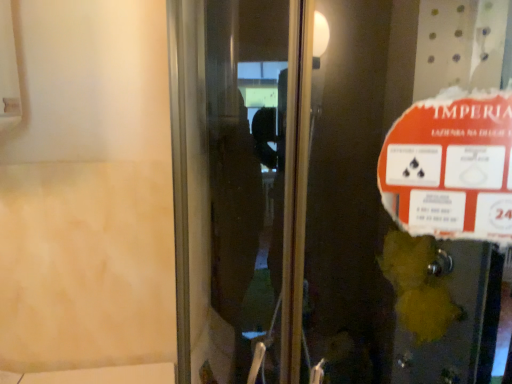
The image size is (512, 384). Describe the element at coordinates (326, 190) in the screenshot. I see `transparent glass elevator door at center` at that location.

Where is `transparent glass elevator door at center`? The width and height of the screenshot is (512, 384). transparent glass elevator door at center is located at coordinates (326, 190).

Image resolution: width=512 pixels, height=384 pixels. Describe the element at coordinates (451, 167) in the screenshot. I see `orange paper sign at upper right` at that location.

Where is `orange paper sign at upper right`? This screenshot has width=512, height=384. orange paper sign at upper right is located at coordinates (451, 167).

The image size is (512, 384). Find the location of `transparent glass elevator door at center`. transparent glass elevator door at center is located at coordinates (326, 190).

Is transparent glass elevator door at center at the left side of orange paper sign at upper right?

Indeed, transparent glass elevator door at center is positioned on the left side of orange paper sign at upper right.

Is transparent glass elevator door at center further to camera compared to orange paper sign at upper right?

No, transparent glass elevator door at center is in front of orange paper sign at upper right.

Considering the points (319, 176) and (445, 194), which point is behind, point (319, 176) or point (445, 194)?

The point (319, 176) is behind.

From the image's perspective, who appears lower, transparent glass elevator door at center or orange paper sign at upper right?

transparent glass elevator door at center is shown below in the image.

From a real-world perspective, who is located higher, transparent glass elevator door at center or orange paper sign at upper right?

→ orange paper sign at upper right.

Considering the sizes of objects transparent glass elevator door at center and orange paper sign at upper right in the image provided, who is thinner, transparent glass elevator door at center or orange paper sign at upper right?

orange paper sign at upper right is thinner.

Who is shorter, transparent glass elevator door at center or orange paper sign at upper right?

Standing shorter between the two is orange paper sign at upper right.

Which of these two, transparent glass elevator door at center or orange paper sign at upper right, is smaller?

Smaller between the two is orange paper sign at upper right.

Is transparent glass elevator door at center positioned beyond the bounds of orange paper sign at upper right?

Yes, transparent glass elevator door at center is outside of orange paper sign at upper right.

Is transparent glass elevator door at center not near orange paper sign at upper right?

transparent glass elevator door at center is actually quite close to orange paper sign at upper right.

Consider the image. Could you tell me if transparent glass elevator door at center is turned towards orange paper sign at upper right?

Yes, transparent glass elevator door at center is turned towards orange paper sign at upper right.

This screenshot has width=512, height=384. What are the coordinates of `elevator door located on the left of orange paper sign at upper right` in the screenshot? It's located at (326, 190).

Looking at this image, which object is positioned more to the right, orange paper sign at upper right or transparent glass elevator door at center?

From the viewer's perspective, orange paper sign at upper right appears more on the right side.

Considering the relative positions of orange paper sign at upper right and transparent glass elevator door at center in the image provided, is orange paper sign at upper right behind transparent glass elevator door at center?

Yes, the depth of orange paper sign at upper right is greater than that of transparent glass elevator door at center.

Does point (392, 127) lie in front of point (316, 69)?

Yes.

From the image's perspective, is orange paper sign at upper right over transparent glass elevator door at center?

Yes, from the image's perspective, orange paper sign at upper right is over transparent glass elevator door at center.

From a real-world perspective, is orange paper sign at upper right located higher than transparent glass elevator door at center?

Yes.

Considering the sizes of objects orange paper sign at upper right and transparent glass elevator door at center in the image provided, who is thinner, orange paper sign at upper right or transparent glass elevator door at center?

With smaller width is orange paper sign at upper right.

Based on the photo, considering the relative sizes of orange paper sign at upper right and transparent glass elevator door at center in the image provided, is orange paper sign at upper right shorter than transparent glass elevator door at center?

Yes, orange paper sign at upper right is shorter than transparent glass elevator door at center.

Does orange paper sign at upper right have a larger size compared to transparent glass elevator door at center?

Actually, orange paper sign at upper right might be smaller than transparent glass elevator door at center.

Can we say orange paper sign at upper right lies outside transparent glass elevator door at center?

No, orange paper sign at upper right is inside or overlapping with transparent glass elevator door at center.

Are orange paper sign at upper right and transparent glass elevator door at center located far from each other?

No, orange paper sign at upper right is in close proximity to transparent glass elevator door at center.

Is orange paper sign at upper right looking in the opposite direction of transparent glass elevator door at center?

That's right, orange paper sign at upper right is facing away from transparent glass elevator door at center.

Locate an element on the screen. The height and width of the screenshot is (384, 512). street sign that is on the right side of transparent glass elevator door at center is located at coordinates (451, 167).

Identify the location of street sign on the right of transparent glass elevator door at center. (451, 167).

In the image, there is a transparent glass elevator door at center. In order to click on street sign above it (from the image's perspective) in this screenshot , I will do `click(451, 167)`.